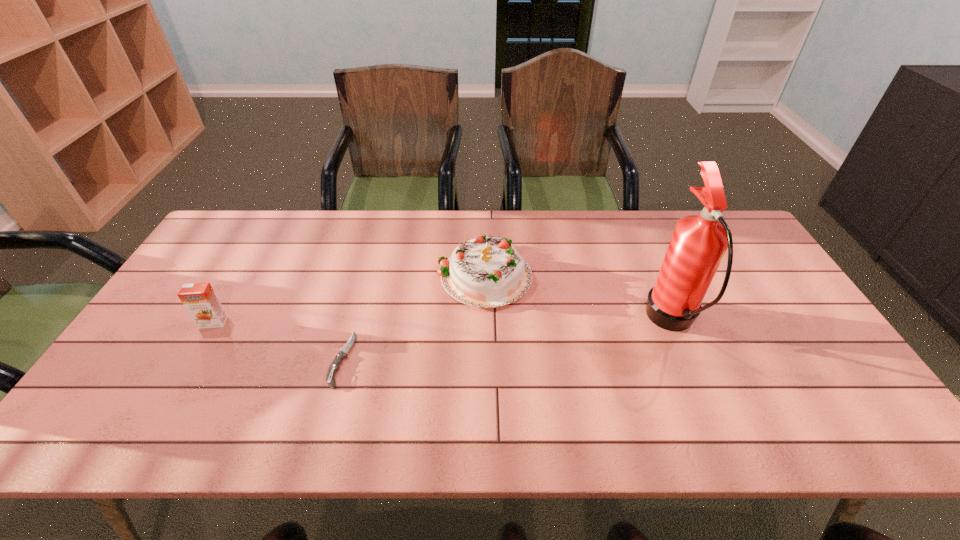
Identify the location of unoccupied area between the second shortest object and the fire extinguisher. The image size is (960, 540). (443, 322).

Locate an element on the screen. The width and height of the screenshot is (960, 540). vacant area that lies between the cake and the tallest object is located at coordinates (578, 298).

In order to click on free space between the second shortest object and the rightmost object in this screenshot , I will do `click(443, 322)`.

At what (x,y) coordinates should I click in order to perform the action: click on free point between the second tallest object and the second shortest object. Please return your answer as a coordinate pair (x, y). Looking at the image, I should click on (348, 299).

Identify the location of free area in between the second shortest object and the shortest object. This screenshot has height=540, width=960. (277, 341).

Where is `empty space that is in between the third tallest object and the pocketknife`? The height and width of the screenshot is (540, 960). empty space that is in between the third tallest object and the pocketknife is located at coordinates (277, 341).

Find the location of a particular element. The width and height of the screenshot is (960, 540). vacant space that is in between the third object from left to right and the tallest object is located at coordinates (578, 298).

The image size is (960, 540). Find the location of `empty space that is in between the third object from left to right and the shortest object`. empty space that is in between the third object from left to right and the shortest object is located at coordinates (413, 317).

Where is `empty location between the third shortest object and the third object from right to left`? empty location between the third shortest object and the third object from right to left is located at coordinates (413, 317).

Identify which object is located as the nearest to the second shortest object. Please provide its 2D coordinates. Your answer should be formatted as a tuple, i.e. [(x, y)], where the tuple contains the x and y coordinates of a point satisfying the conditions above.

[(334, 367)]